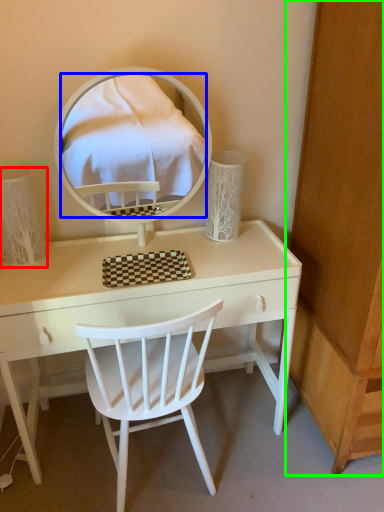
Question: Based on their relative distances, which object is farther from table lamp (highlighted by a red box)? Choose from mirror (highlighted by a blue box) and dresser (highlighted by a green box).

Choices:
 (A) mirror
 (B) dresser

Answer: (A)